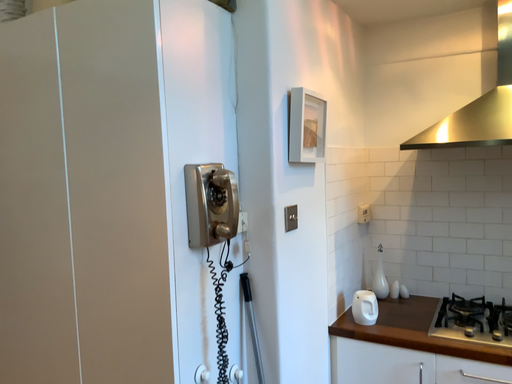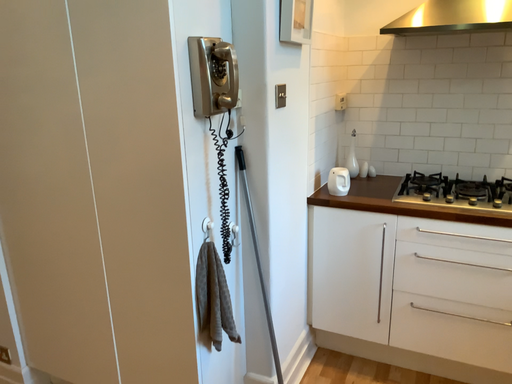
Question: How did the camera likely rotate when shooting the video?

Choices:
 (A) rotated upward
 (B) rotated downward

Answer: (B)